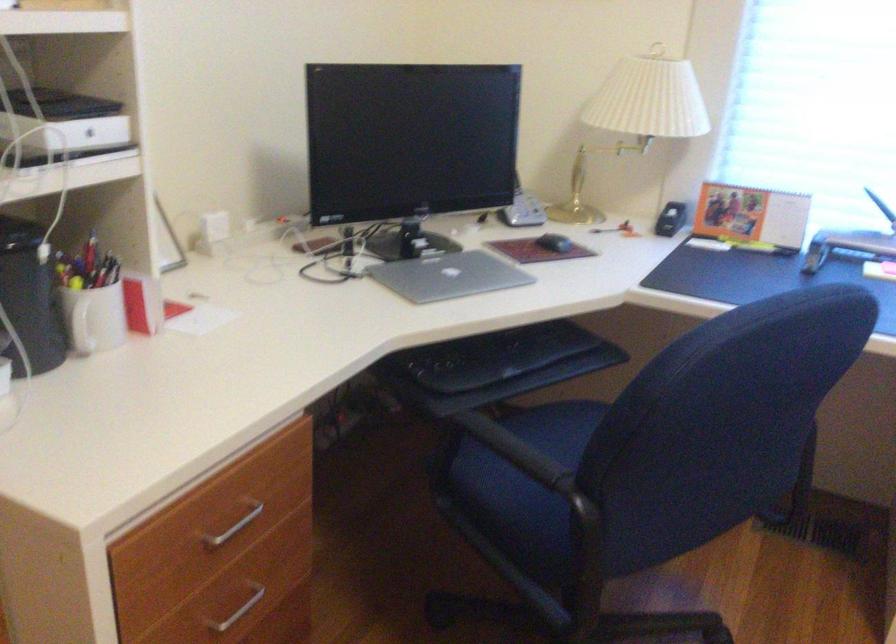
The height and width of the screenshot is (644, 896). What do you see at coordinates (494, 366) in the screenshot?
I see `the black keyboard tray` at bounding box center [494, 366].